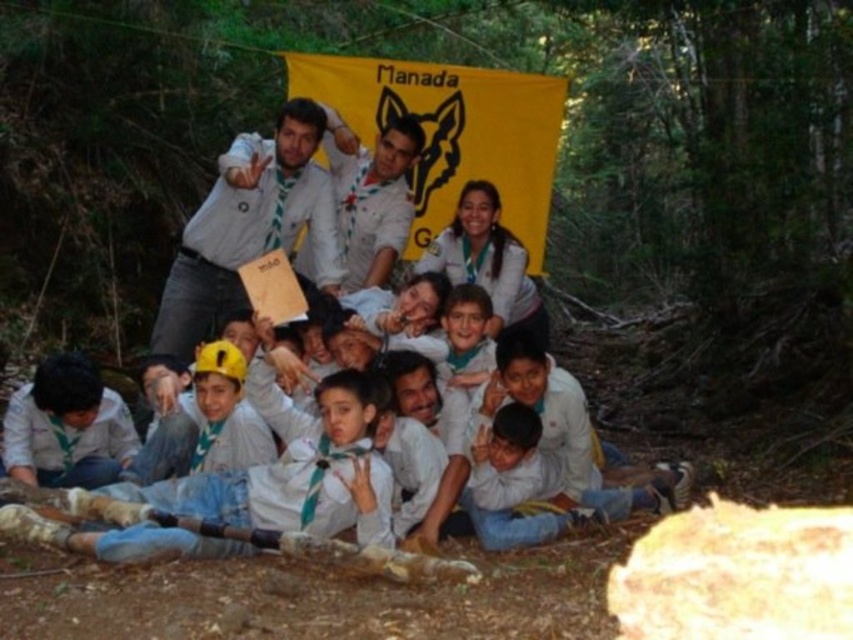
You are a photographer standing at the edge of the campsite. You want to take a group photo of the matte white shirt at center and white fabric shirt at center. The camera you are using has a minimum focus distance of 25 inches. Can you take the photo without moving either of the subjects?

The distance between the matte white shirt at center and white fabric shirt at center is 25.86 inches, which is greater than the camera minimum focus distance of 25 inches. Therefore, the photographer can take the photo without moving either subject.

You are a photographer trying to capture a group photo of the scouts in the wooded area. You notice the matte white shirt at center and the yellow matte helmet at center. Which object should you adjust to ensure both are fully visible in the photo?

The matte white shirt at center is much taller than the yellow matte helmet at center, so you should lower the camera angle to include the full height of the matte white shirt at center while still capturing the yellow matte helmet at center.